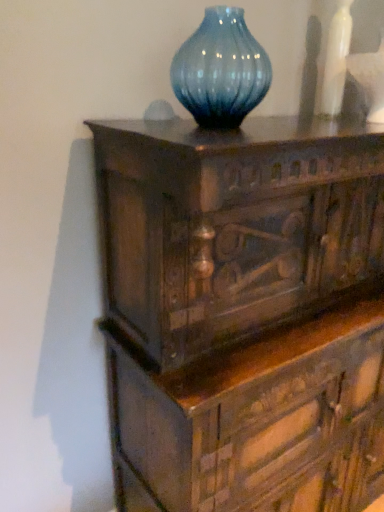
Question: From the image's perspective, is dark wood chest of drawers at center above or below white glossy vase at upper right?

Choices:
 (A) above
 (B) below

Answer: (B)

Question: Considering the positions of point (172, 303) and point (327, 62), is point (172, 303) closer or farther from the camera than point (327, 62)?

Choices:
 (A) closer
 (B) farther

Answer: (A)

Question: In the image, is dark wood chest of drawers at center positioned in front of or behind white glossy vase at upper right?

Choices:
 (A) front
 (B) behind

Answer: (A)

Question: From their relative heights in the image, would you say white glossy vase at upper right is taller or shorter than dark wood chest of drawers at center?

Choices:
 (A) tall
 (B) short

Answer: (B)

Question: Would you say white glossy vase at upper right is inside or outside dark wood chest of drawers at center?

Choices:
 (A) inside
 (B) outside

Answer: (B)

Question: From a real-world perspective, is white glossy vase at upper right physically located above or below dark wood chest of drawers at center?

Choices:
 (A) below
 (B) above

Answer: (B)

Question: Relative to dark wood chest of drawers at center, is white glossy vase at upper right in front or behind?

Choices:
 (A) behind
 (B) front

Answer: (A)